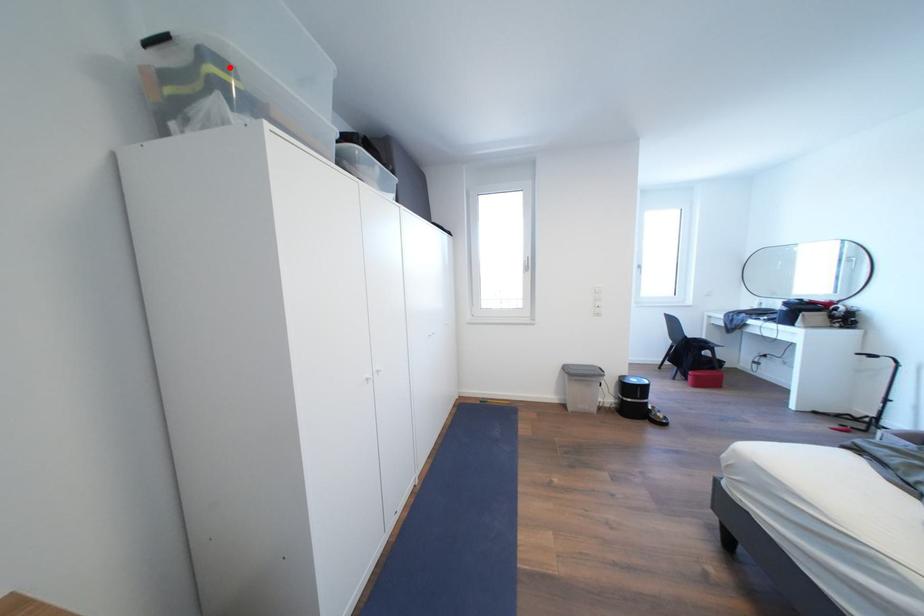
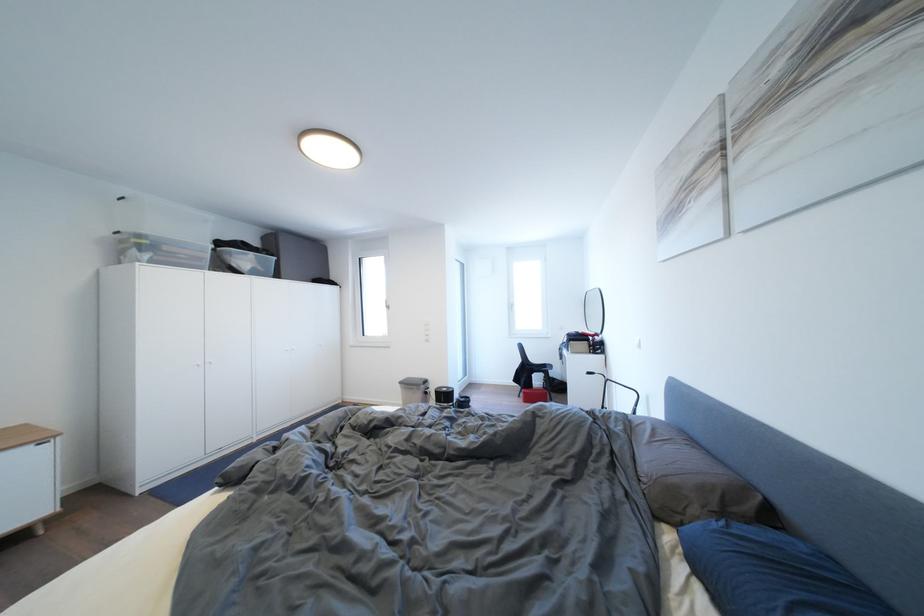
Find the pixel in the second image that matches the highlighted location in the first image.

(149, 241)